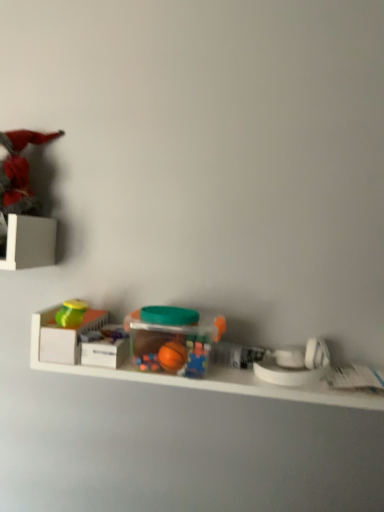
Question: Is white plastic toy at right, acting as the 4th toy starting from the top, wider or thinner than matte green lid at left, the second toy from the top?

Choices:
 (A) wide
 (B) thin

Answer: (A)

Question: From a real-world perspective, is white plastic toy at right, arranged as the first toy when ordered from the bottom, physically located above or below matte green lid at left, which appears as the 2th toy when viewed from the left?

Choices:
 (A) above
 (B) below

Answer: (B)

Question: Considering the real-world distances, which object is closest to the white matte storage box at left?

Choices:
 (A) translucent plastic container at center, the third toy in the top-to-bottom sequence
 (B) matte green lid at left, the third toy viewed from the right
 (C) translucent plastic toys at center
 (D) matte red flower at upper left, positioned as the 4th toy in bottom-to-top order
 (E) white plastic toy at right, the first toy positioned from the right

Answer: (B)

Question: Which object is the farthest from the translucent plastic container at center, the third toy in the top-to-bottom sequence?

Choices:
 (A) matte green lid at left, arranged as the 3th toy when ordered from the bottom
 (B) translucent plastic toys at center
 (C) white matte storage box at left
 (D) matte red flower at upper left, marked as the first toy in a left-to-right arrangement
 (E) white plastic toy at right, the first toy positioned from the right

Answer: (D)